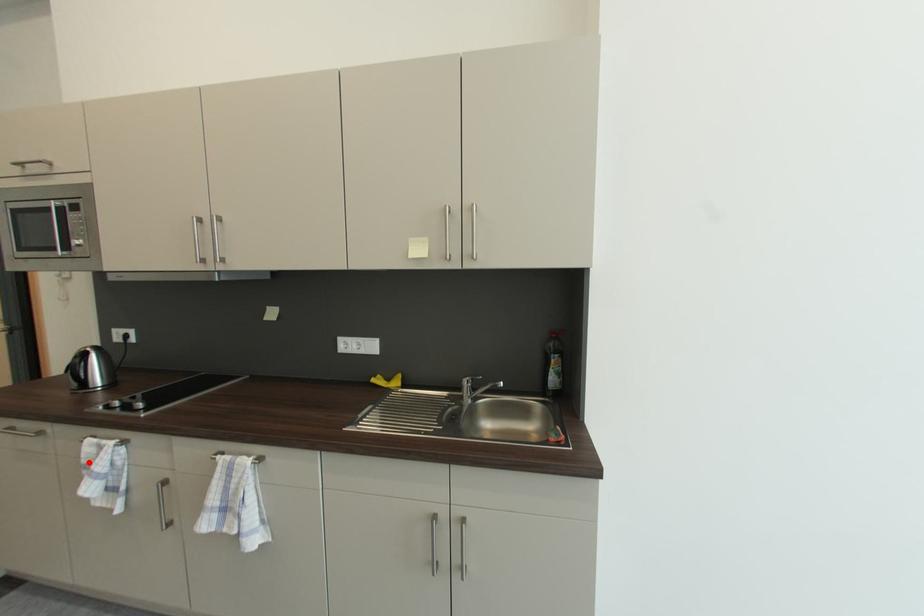
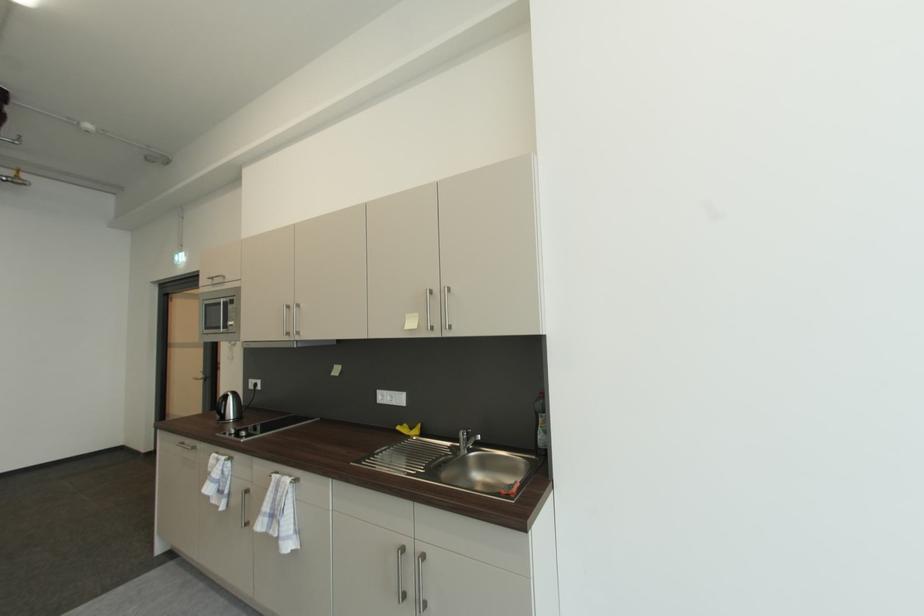
Find the pixel in the second image that matches the highlighted location in the first image.

(215, 471)